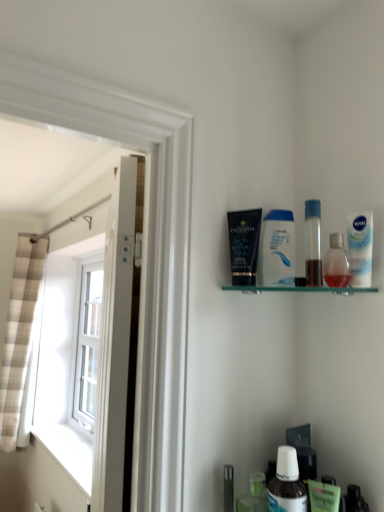
Question: From a real-world perspective, is white glossy door at left positioned under matte black tube at upper center, acting as the 1th toiletry starting from the top, based on gravity?

Choices:
 (A) no
 (B) yes

Answer: (B)

Question: Considering the relative sizes of white glossy door at left and matte black tube at upper center, which appears as the 3th toiletry when ordered from the bottom, in the image provided, is white glossy door at left bigger than matte black tube at upper center, which appears as the 3th toiletry when ordered from the bottom,?

Choices:
 (A) no
 (B) yes

Answer: (B)

Question: Is white glossy door at left outside matte black tube at upper center, which is counted as the 3th toiletry, starting from the right?

Choices:
 (A) yes
 (B) no

Answer: (A)

Question: Is white glossy door at left wider than matte black tube at upper center, acting as the 1th toiletry starting from the left?

Choices:
 (A) no
 (B) yes

Answer: (B)

Question: Are white glossy door at left and matte black tube at upper center, which is counted as the 3th toiletry, starting from the right, beside each other?

Choices:
 (A) no
 (B) yes

Answer: (A)

Question: Considering the positions of plaid fabric curtain at left and white glossy door at left in the image, is plaid fabric curtain at left bigger or smaller than white glossy door at left?

Choices:
 (A) small
 (B) big

Answer: (A)

Question: In terms of width, does plaid fabric curtain at left look wider or thinner when compared to white glossy door at left?

Choices:
 (A) wide
 (B) thin

Answer: (A)

Question: Is point (26, 270) closer or farther from the camera than point (119, 349)?

Choices:
 (A) farther
 (B) closer

Answer: (A)

Question: Considering their positions, is plaid fabric curtain at left located in front of or behind white glossy door at left?

Choices:
 (A) behind
 (B) front

Answer: (A)

Question: From a real-world perspective, relative to plaid fabric curtain at left, is transparent plastic spray bottle at upper right, the 2th toiletry positioned from the bottom, vertically above or below?

Choices:
 (A) above
 (B) below

Answer: (A)

Question: Does point (342, 286) appear closer or farther from the camera than point (4, 333)?

Choices:
 (A) farther
 (B) closer

Answer: (B)

Question: Is transparent plastic spray bottle at upper right, the 2th toiletry positioned from the bottom, wider or thinner than plaid fabric curtain at left?

Choices:
 (A) wide
 (B) thin

Answer: (B)

Question: Choose the correct answer: Is transparent plastic spray bottle at upper right, the third toiletry when ordered from left to right, inside plaid fabric curtain at left or outside it?

Choices:
 (A) inside
 (B) outside

Answer: (B)

Question: Is point (8, 340) closer or farther from the camera than point (317, 226)?

Choices:
 (A) farther
 (B) closer

Answer: (A)

Question: Is plaid fabric curtain at left taller or shorter than transparent plastic bottle at upper right, which is the fourth mouthwash from bottom to top?

Choices:
 (A) short
 (B) tall

Answer: (B)